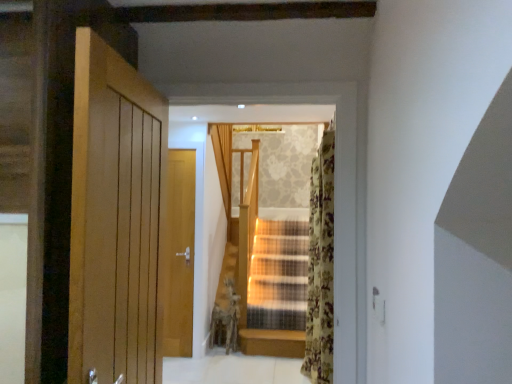
Question: Is the position of light beige fabric curtain at center, which is counted as the 2th curtain, starting from the front, less distant than that of floral fabric curtain at right, the 1th curtain positioned from the front?

Choices:
 (A) yes
 (B) no

Answer: (B)

Question: Considering the relative sizes of light beige fabric curtain at center, the 2th curtain viewed from the right, and floral fabric curtain at right, which is the first curtain in right-to-left order, in the image provided, is light beige fabric curtain at center, the 2th curtain viewed from the right, bigger than floral fabric curtain at right, which is the first curtain in right-to-left order,?

Choices:
 (A) no
 (B) yes

Answer: (B)

Question: From the image's perspective, would you say light beige fabric curtain at center, which is counted as the 2th curtain, starting from the front, is shown under floral fabric curtain at right, which appears as the second curtain when viewed from the left?

Choices:
 (A) yes
 (B) no

Answer: (B)

Question: Is light beige fabric curtain at center, which is counted as the 2th curtain, starting from the front, next to floral fabric curtain at right, the 2th curtain in the back-to-front sequence, and touching it?

Choices:
 (A) yes
 (B) no

Answer: (B)

Question: Does light beige fabric curtain at center, arranged as the 1th curtain when viewed from the back, have a lesser height compared to floral fabric curtain at right, which appears as the second curtain when viewed from the left?

Choices:
 (A) no
 (B) yes

Answer: (B)

Question: Is light beige fabric curtain at center, arranged as the 1th curtain when viewed from the back, facing away from floral fabric curtain at right, which appears as the second curtain when viewed from the left?

Choices:
 (A) no
 (B) yes

Answer: (A)

Question: Can you confirm if floral fabric curtain at right, the 1th curtain positioned from the front, is positioned to the left of light beige fabric curtain at center, which is the first curtain from left to right?

Choices:
 (A) yes
 (B) no

Answer: (B)

Question: Is floral fabric curtain at right, which is the first curtain in right-to-left order, taller than light beige fabric curtain at center, the 2th curtain viewed from the right?

Choices:
 (A) no
 (B) yes

Answer: (B)

Question: Can you confirm if floral fabric curtain at right, the 1th curtain positioned from the front, is smaller than light beige fabric curtain at center, which is the first curtain from left to right?

Choices:
 (A) yes
 (B) no

Answer: (A)

Question: Is light beige fabric curtain at center, the 2th curtain viewed from the right, completely or partially inside floral fabric curtain at right, the 2th curtain in the back-to-front sequence?

Choices:
 (A) no
 (B) yes

Answer: (A)

Question: Does floral fabric curtain at right, the 2th curtain in the back-to-front sequence, have a lesser width compared to light beige fabric curtain at center, which is counted as the 2th curtain, starting from the front?

Choices:
 (A) no
 (B) yes

Answer: (A)

Question: Does floral fabric curtain at right, which appears as the second curtain when viewed from the left, appear on the right side of light beige fabric curtain at center, which is the first curtain from left to right?

Choices:
 (A) no
 (B) yes

Answer: (B)

Question: Is floral fabric curtain at right, the 1th curtain positioned from the front, in front of or behind light beige fabric curtain at center, which is counted as the 2th curtain, starting from the front, in the image?

Choices:
 (A) front
 (B) behind

Answer: (A)